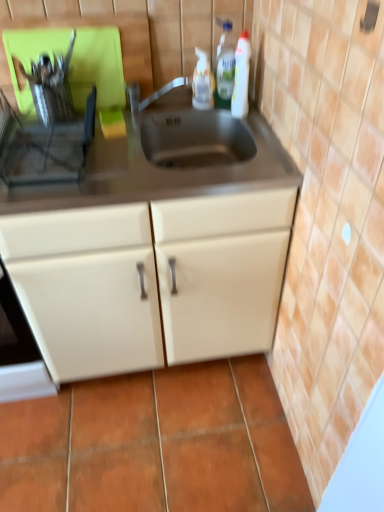
You are a GUI agent. You are given a task and a screenshot of the screen. Output one action in this format:
    pyautogui.click(x=<x>, y=<y>)
    Task: Click on the vacant space to the left of translucent plastic spray bottle at upper center, the first bottle viewed from the left
    Image resolution: width=384 pixels, height=512 pixels.
    Given the screenshot: What is the action you would take?
    pyautogui.click(x=177, y=106)